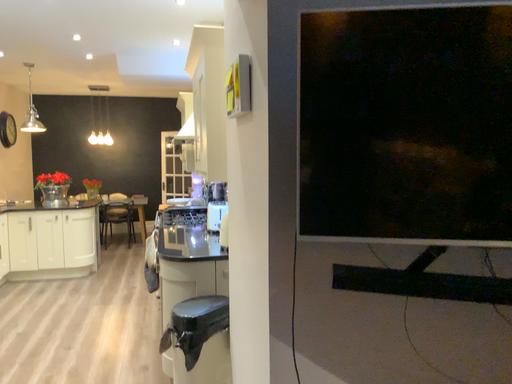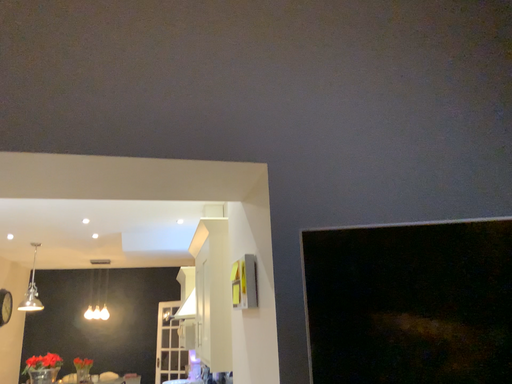
Question: Which way did the camera rotate in the video?

Choices:
 (A) rotated upward
 (B) rotated downward

Answer: (A)